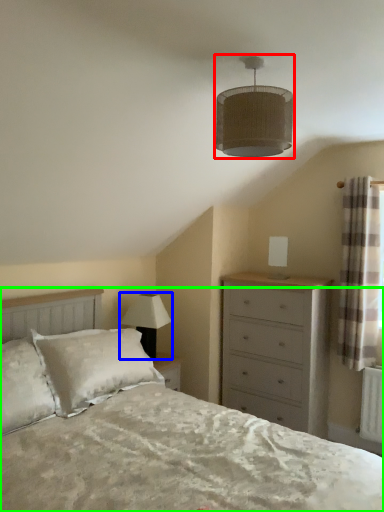
Question: Estimate the real-world distances between objects in this image. Which object is closer to lamp (highlighted by a red box), lamp (highlighted by a blue box) or bed (highlighted by a green box)?

Choices:
 (A) lamp
 (B) bed

Answer: (B)